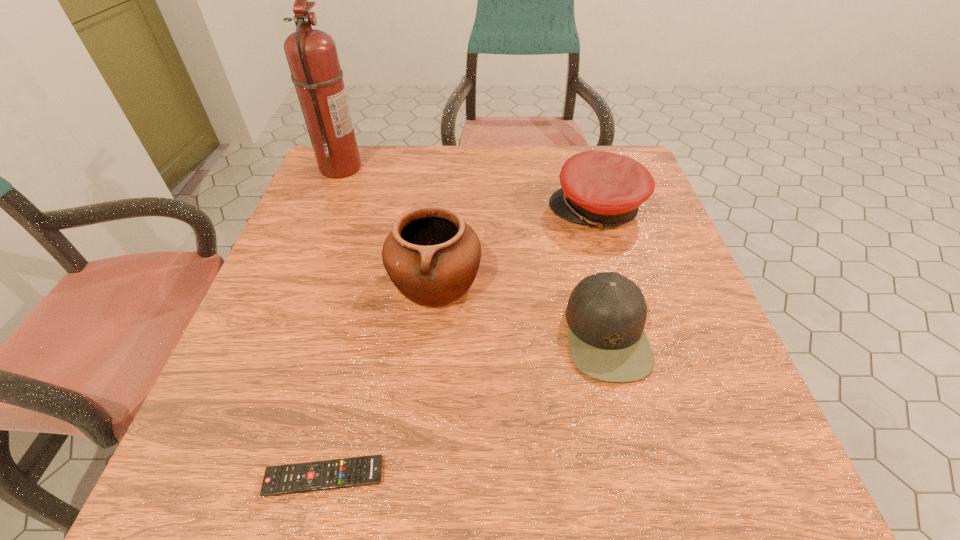
Identify the location of fire extinguisher. This screenshot has height=540, width=960. (312, 56).

This screenshot has width=960, height=540. Find the location of `the tallest object`. the tallest object is located at coordinates (312, 56).

What are the coordinates of `pottery` in the screenshot? It's located at (432, 256).

Where is `the fourth nearest object`? Image resolution: width=960 pixels, height=540 pixels. the fourth nearest object is located at coordinates (603, 189).

This screenshot has width=960, height=540. I want to click on the nearer cap, so click(606, 313).

The width and height of the screenshot is (960, 540). What are the coordinates of `the nearest object` in the screenshot? It's located at (339, 473).

This screenshot has height=540, width=960. Find the location of `the shortest object`. the shortest object is located at coordinates (339, 473).

Find the location of a particular element. This screenshot has height=540, width=960. free spot located on the front-facing side of the farthest object is located at coordinates (398, 167).

Where is `vacant space located on the right of the fourth shortest object`? The image size is (960, 540). vacant space located on the right of the fourth shortest object is located at coordinates (559, 281).

Locate an element on the screen. The width and height of the screenshot is (960, 540). free space located on the front of the second farthest object with an emblem is located at coordinates (435, 210).